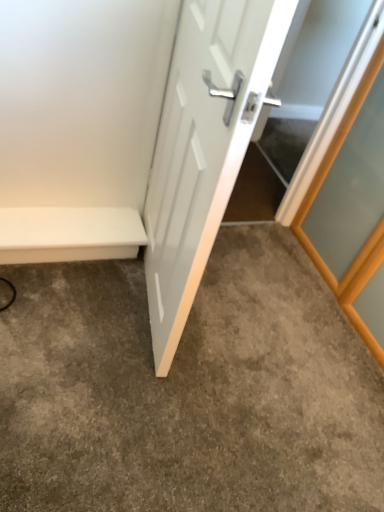
Question: Is white matte bench at lower left a part of gray carpet at center?

Choices:
 (A) yes
 (B) no

Answer: (B)

Question: Can you confirm if gray carpet at center is smaller than white matte bench at lower left?

Choices:
 (A) no
 (B) yes

Answer: (A)

Question: Is gray carpet at center oriented away from white matte bench at lower left?

Choices:
 (A) no
 (B) yes

Answer: (A)

Question: Does gray carpet at center have a lesser width compared to white matte bench at lower left?

Choices:
 (A) no
 (B) yes

Answer: (A)

Question: From a real-world perspective, is gray carpet at center under white matte bench at lower left?

Choices:
 (A) no
 (B) yes

Answer: (B)

Question: Considering the relative sizes of gray carpet at center and white matte bench at lower left in the image provided, is gray carpet at center wider than white matte bench at lower left?

Choices:
 (A) yes
 (B) no

Answer: (A)

Question: Would you say gray carpet at center contains white glossy door at center?

Choices:
 (A) no
 (B) yes

Answer: (A)

Question: From a real-world perspective, is gray carpet at center under white glossy door at center?

Choices:
 (A) yes
 (B) no

Answer: (A)

Question: Considering the relative sizes of gray carpet at center and white glossy door at center in the image provided, is gray carpet at center wider than white glossy door at center?

Choices:
 (A) yes
 (B) no

Answer: (A)

Question: Can you confirm if gray carpet at center is shorter than white glossy door at center?

Choices:
 (A) yes
 (B) no

Answer: (A)

Question: Can you confirm if gray carpet at center is thinner than white glossy door at center?

Choices:
 (A) no
 (B) yes

Answer: (A)

Question: Considering the relative sizes of gray carpet at center and white glossy door at center in the image provided, is gray carpet at center bigger than white glossy door at center?

Choices:
 (A) yes
 (B) no

Answer: (B)

Question: From a real-world perspective, is white matte bench at lower left located beneath gray carpet at center?

Choices:
 (A) no
 (B) yes

Answer: (A)